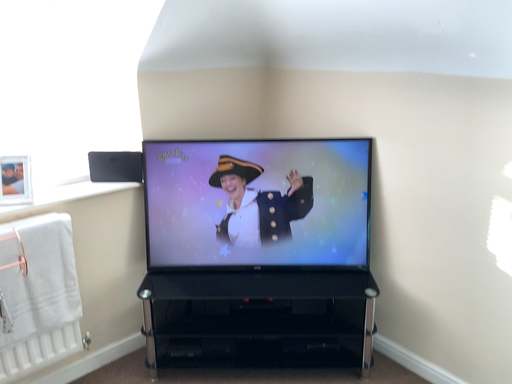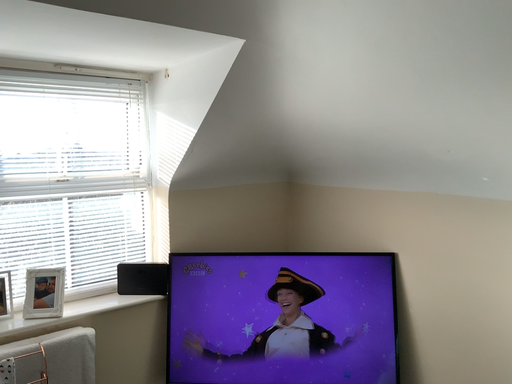
Question: Which way did the camera rotate in the video?

Choices:
 (A) rotated downward
 (B) rotated upward

Answer: (B)